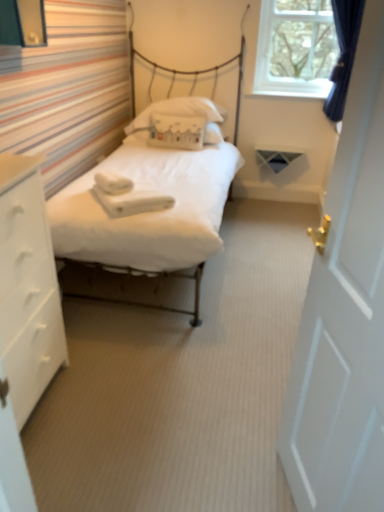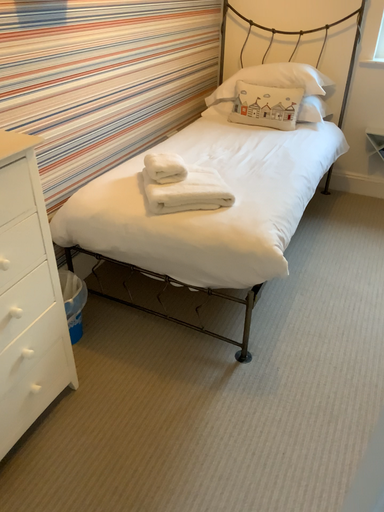
Question: Which way did the camera rotate in the video?

Choices:
 (A) rotated left
 (B) rotated right

Answer: (A)